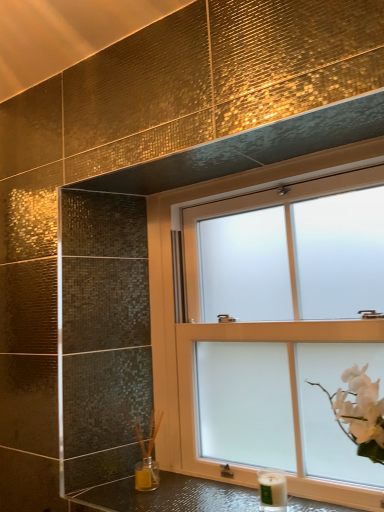
Question: Is white matte candle at lower right far away from frosted glass window at upper center?

Choices:
 (A) no
 (B) yes

Answer: (A)

Question: Would you say frosted glass window at upper center is part of white matte candle at lower right's contents?

Choices:
 (A) no
 (B) yes

Answer: (A)

Question: Is white matte candle at lower right placed right next to frosted glass window at upper center?

Choices:
 (A) no
 (B) yes

Answer: (A)

Question: Is white matte candle at lower right shorter than frosted glass window at upper center?

Choices:
 (A) no
 (B) yes

Answer: (B)

Question: Is white matte candle at lower right outside frosted glass window at upper center?

Choices:
 (A) no
 (B) yes

Answer: (B)

Question: Can you confirm if white matte candle at lower right is bigger than frosted glass window at upper center?

Choices:
 (A) yes
 (B) no

Answer: (B)

Question: Is shiny metallic counter top at lower center placed right next to frosted glass window at upper center?

Choices:
 (A) yes
 (B) no

Answer: (B)

Question: Does shiny metallic counter top at lower center turn towards frosted glass window at upper center?

Choices:
 (A) no
 (B) yes

Answer: (A)

Question: Considering the relative sizes of shiny metallic counter top at lower center and frosted glass window at upper center in the image provided, is shiny metallic counter top at lower center bigger than frosted glass window at upper center?

Choices:
 (A) yes
 (B) no

Answer: (B)

Question: Does shiny metallic counter top at lower center come in front of frosted glass window at upper center?

Choices:
 (A) no
 (B) yes

Answer: (B)

Question: From a real-world perspective, is shiny metallic counter top at lower center located higher than frosted glass window at upper center?

Choices:
 (A) yes
 (B) no

Answer: (B)

Question: Does shiny metallic counter top at lower center appear on the right side of frosted glass window at upper center?

Choices:
 (A) no
 (B) yes

Answer: (A)

Question: Is white matte candle at lower right bigger than shiny metallic counter top at lower center?

Choices:
 (A) no
 (B) yes

Answer: (A)